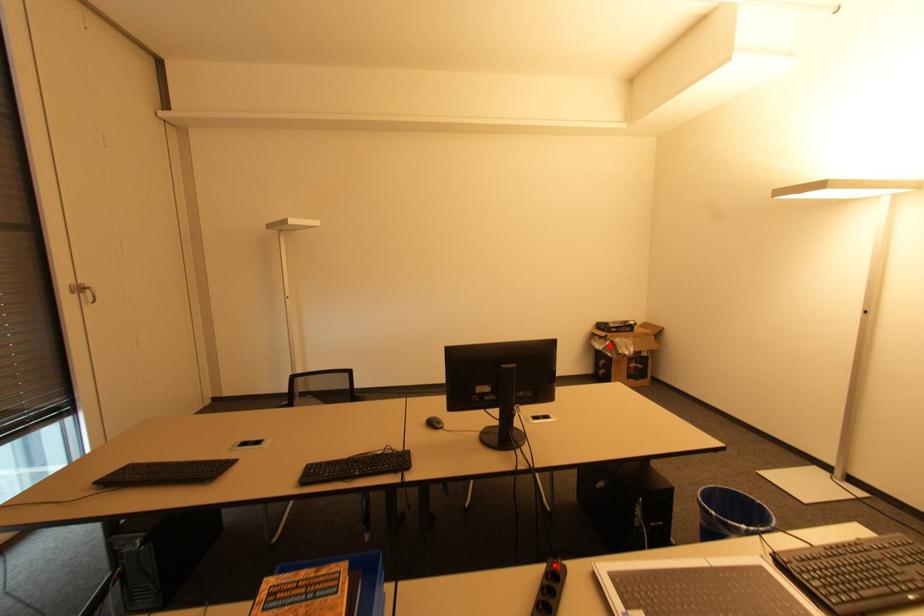
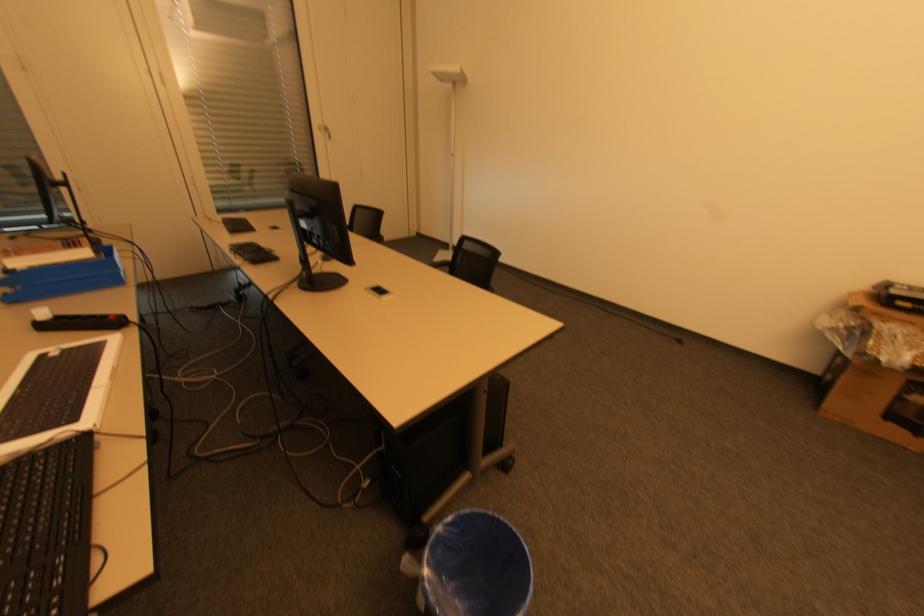
In the second image, find the point that corresponds to the highlighted location in the first image.

(850, 328)